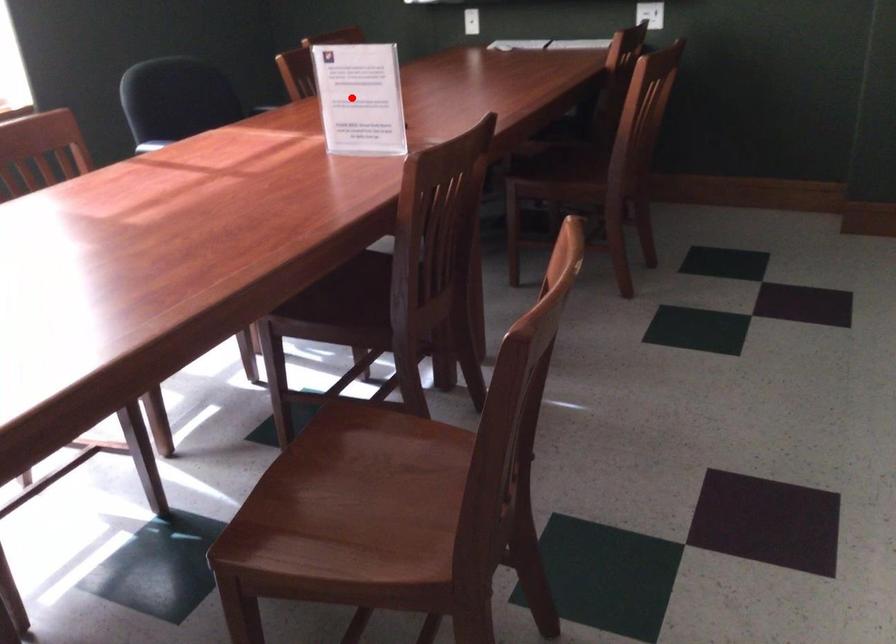
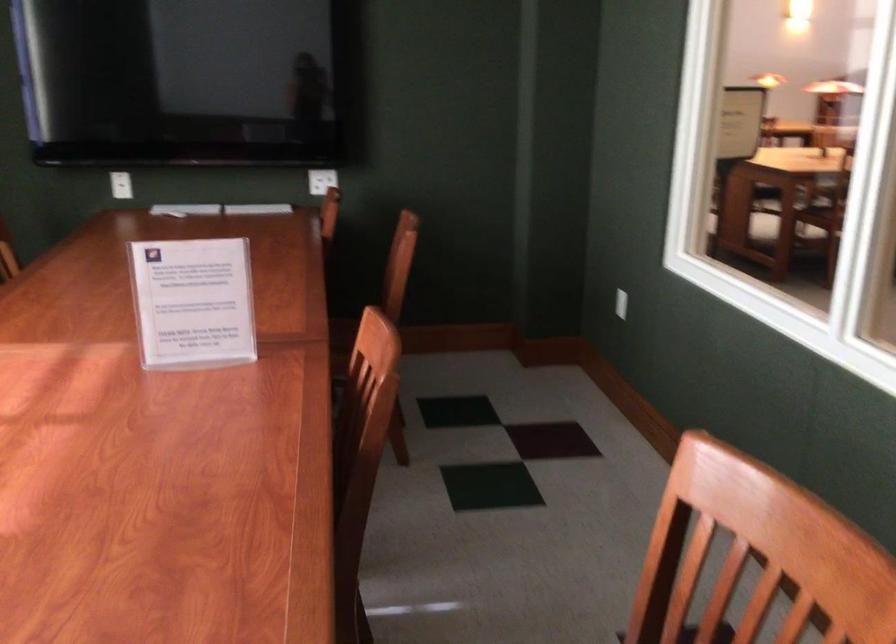
Where in the second image is the point corresponding to the highlighted location from the first image?

(193, 303)